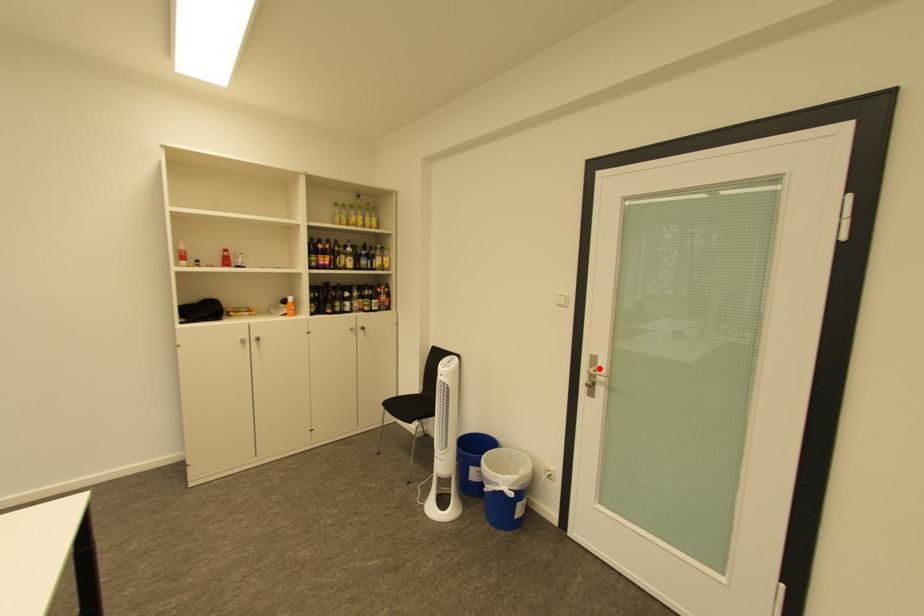
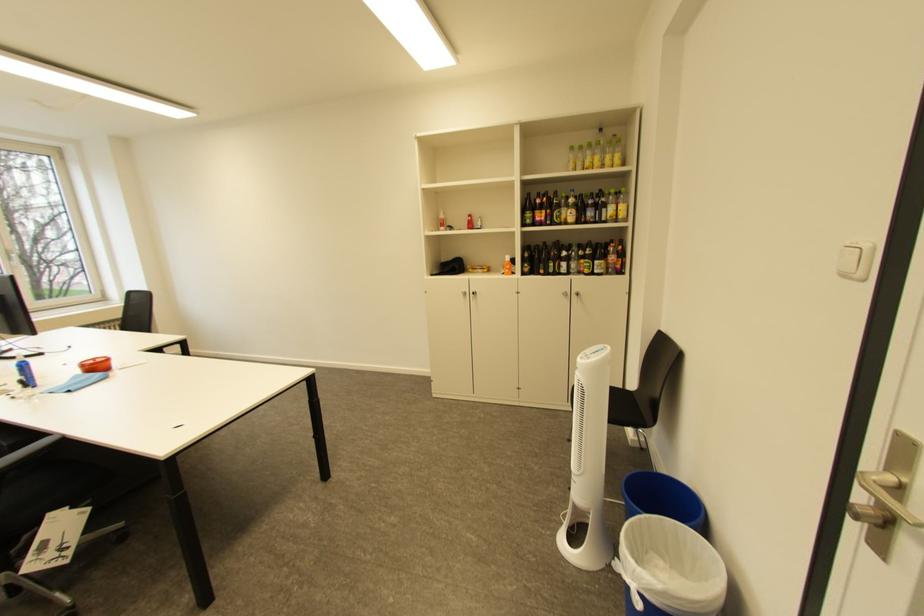
Question: I am providing you with two images of the same scene from different viewpoints. A red point is marked on the first image. Is the red point's position out of view in image 2?

Choices:
 (A) Yes
 (B) No

Answer: (B)